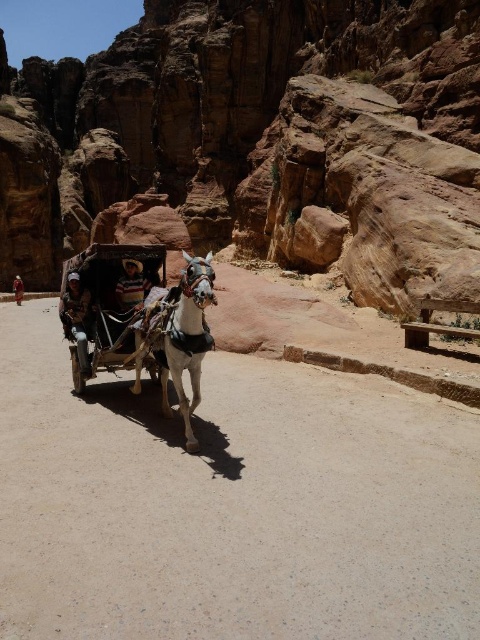
Question: From the image, what is the correct spatial relationship of wooden cart at center in relation to dark brown leather jacket at center?

Choices:
 (A) right
 (B) left

Answer: (A)

Question: Among these points, which one is nearest to the camera?

Choices:
 (A) (170, 289)
 (B) (97, 304)

Answer: (A)

Question: Is wooden cart at center thinner than white glossy horse at center?

Choices:
 (A) no
 (B) yes

Answer: (A)

Question: Observing the image, what is the correct spatial positioning of dark brown leather jacket at left in reference to striped shirt at center?

Choices:
 (A) left
 (B) right

Answer: (A)

Question: Which object is farther from the camera taking this photo?

Choices:
 (A) white glossy horse at center
 (B) dark brown leather jacket at left
 (C) dark brown leather jacket at center

Answer: (C)

Question: Which point is farther from the camera taking this photo?

Choices:
 (A) (81, 348)
 (B) (192, 285)
 (C) (16, 278)

Answer: (C)